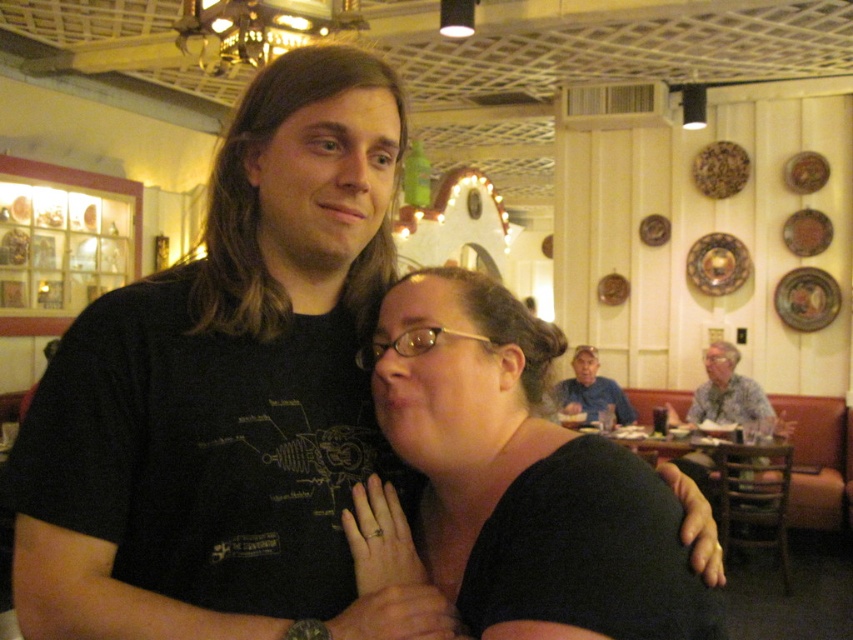
Between point (485, 506) and point (724, 410), which one is positioned in front?

Point (485, 506) is in front.

Which is behind, point (413, 579) or point (695, 413)?

The point (695, 413) is more distant.

The height and width of the screenshot is (640, 853). Describe the element at coordinates (468, 456) in the screenshot. I see `black matte shirt at center` at that location.

This screenshot has height=640, width=853. I want to click on black matte shirt at center, so click(x=468, y=456).

Does black matte shirt at center appear on the right side of blue denim shirt at upper center?

No, black matte shirt at center is not to the right of blue denim shirt at upper center.

Between black matte shirt at center and blue denim shirt at upper center, which one has more height?

With more height is blue denim shirt at upper center.

Find the location of `black matte shirt at center`. black matte shirt at center is located at coordinates (468, 456).

Does hawaiian print shirt at right have a lesser width compared to blue denim shirt at upper center?

No, hawaiian print shirt at right is not thinner than blue denim shirt at upper center.

Between hawaiian print shirt at right and blue denim shirt at upper center, which one is positioned lower?

hawaiian print shirt at right is below.

Between point (712, 406) and point (578, 387), which one is positioned in front?

Positioned in front is point (712, 406).

Locate an element on the screen. hawaiian print shirt at right is located at coordinates (730, 396).